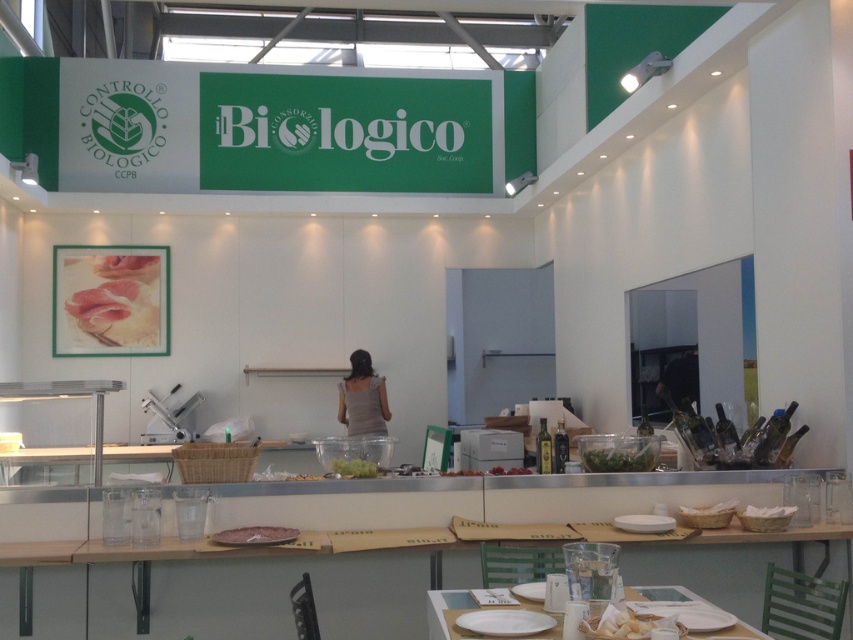
You are a food critic attending the trade show and want to compare the sizes of the white glossy plate at lower center and the green leafy vegetable at center displayed at the Il Biologico booth. Which one is bigger?

The white glossy plate at lower center has a larger size compared to the green leafy vegetable at center, so the white glossy plate at lower center is bigger.

You are at the Il Biologico booth and see a white glossy plate at lower center and a pinkish matte meat at lower center. Which object is positioned to the right of the other?

The white glossy plate at lower center is to the right of the pinkish matte meat at lower center.

You are at the Il Biologico booth and see a white glossy plate at lower center and a green leafy vegetable at center. Which item is located more to the left?

The white glossy plate at lower center is positioned on the left side of the green leafy vegetable at center, so it is more to the left.